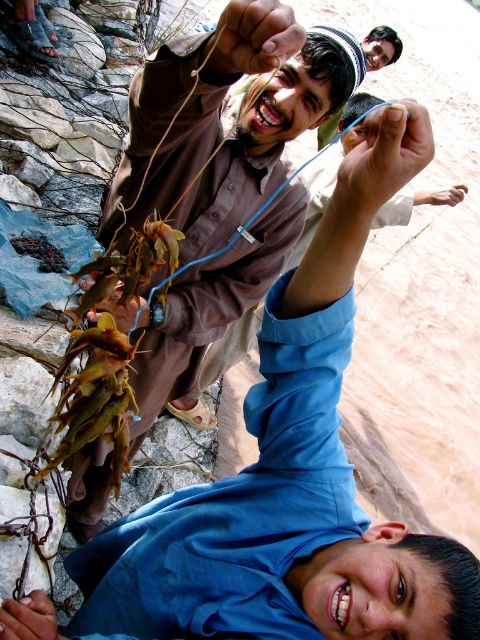
Question: Is smooth skin hand at lower left to the right of matte brown hand at upper center from the viewer's perspective?

Choices:
 (A) no
 (B) yes

Answer: (A)

Question: Which is farther from the blue fabric cap at upper center?

Choices:
 (A) matte brown hand at upper center
 (B) blue wire at center
 (C) smooth skin hand at upper center
 (D) matte blue wire at center

Answer: (B)

Question: Where is smooth skin hand at lower left located in relation to matte blue wire at center in the image?

Choices:
 (A) above
 (B) below

Answer: (B)

Question: Which of the following is the farthest from the observer?

Choices:
 (A) (40, 621)
 (B) (451, 193)
 (C) (412, 173)

Answer: (B)

Question: In this image, where is smooth skin hand at lower left located relative to matte blue wire at center?

Choices:
 (A) above
 (B) below

Answer: (B)

Question: Which point appears farthest from the camera in this image?

Choices:
 (A) (444, 188)
 (B) (415, 148)
 (C) (31, 618)
 (D) (220, 29)

Answer: (A)